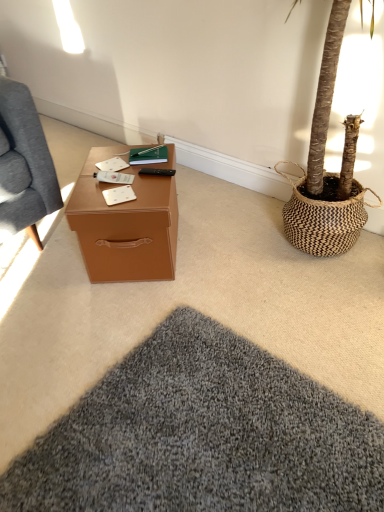
Question: Is black matte remote control at center further to camera compared to white matte notepad at center?

Choices:
 (A) yes
 (B) no

Answer: (A)

Question: From the image's perspective, would you say black matte remote control at center is shown under white matte notepad at center?

Choices:
 (A) yes
 (B) no

Answer: (B)

Question: Considering the relative sizes of black matte remote control at center and white matte notepad at center in the image provided, is black matte remote control at center thinner than white matte notepad at center?

Choices:
 (A) no
 (B) yes

Answer: (B)

Question: Is black matte remote control at center to the right of white matte notepad at center from the viewer's perspective?

Choices:
 (A) no
 (B) yes

Answer: (B)

Question: Is there a large distance between black matte remote control at center and white matte notepad at center?

Choices:
 (A) yes
 (B) no

Answer: (B)

Question: Is black matte remote control at center oriented towards white matte notepad at center?

Choices:
 (A) no
 (B) yes

Answer: (B)

Question: Are soft gray carpet at center and black matte remote control at center making contact?

Choices:
 (A) no
 (B) yes

Answer: (A)

Question: Is soft gray carpet at center in front of black matte remote control at center?

Choices:
 (A) no
 (B) yes

Answer: (B)

Question: Does soft gray carpet at center have a lesser height compared to black matte remote control at center?

Choices:
 (A) no
 (B) yes

Answer: (A)

Question: Can black matte remote control at center be found inside soft gray carpet at center?

Choices:
 (A) yes
 (B) no

Answer: (B)

Question: Is soft gray carpet at center at the right side of black matte remote control at center?

Choices:
 (A) yes
 (B) no

Answer: (B)

Question: Is soft gray carpet at center wider than black matte remote control at center?

Choices:
 (A) yes
 (B) no

Answer: (A)

Question: From the image's perspective, is brown leather desk at center on soft gray carpet at center?

Choices:
 (A) yes
 (B) no

Answer: (A)